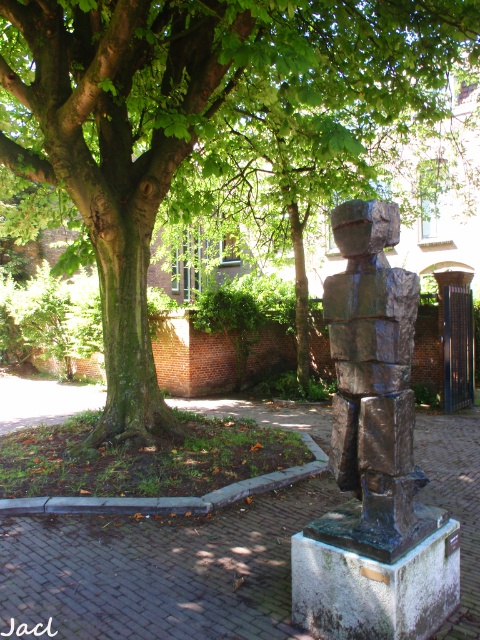
Question: Does green leafy tree at center have a lesser width compared to bronze statue at center?

Choices:
 (A) yes
 (B) no

Answer: (A)

Question: Among these points, which one is nearest to the camera?

Choices:
 (A) (340, 289)
 (B) (355, 104)

Answer: (A)

Question: Is green leafy tree at center bigger than bronze statue at center?

Choices:
 (A) no
 (B) yes

Answer: (A)

Question: Is green leafy tree at center positioned before bronze statue at center?

Choices:
 (A) no
 (B) yes

Answer: (A)

Question: Which object appears farthest from the camera in this image?

Choices:
 (A) bronze statue at center
 (B) green leafy tree at center

Answer: (B)